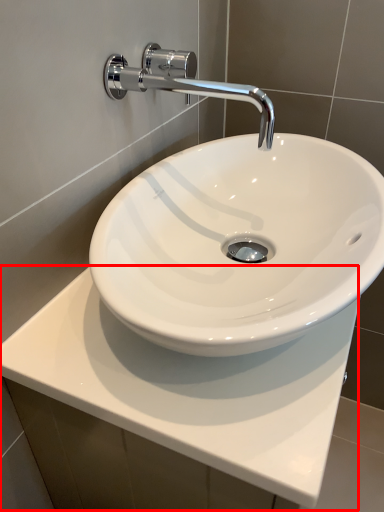
Question: From the image, what is the correct spatial relationship of counter top (annotated by the red box) in relation to tap?

Choices:
 (A) left
 (B) right

Answer: (B)